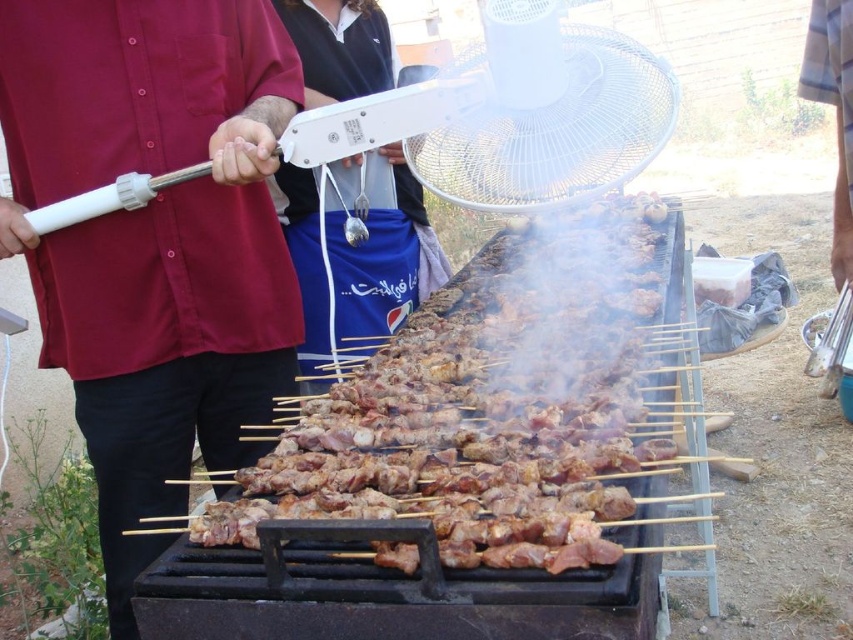
Question: Does maroon shirt at center appear on the right side of blue fabric shirt at center?

Choices:
 (A) yes
 (B) no

Answer: (B)

Question: Among these objects, which one is farthest from the camera?

Choices:
 (A) maroon shirt at center
 (B) blue fabric shirt at center
 (C) dark blue fabric pants at center

Answer: (C)

Question: Which of the following is the closest to the observer?

Choices:
 (A) (106, 493)
 (B) (819, 28)
 (C) (303, 465)

Answer: (C)

Question: Is maroon shirt at center to the left of blue fabric shirt at center from the viewer's perspective?

Choices:
 (A) no
 (B) yes

Answer: (B)

Question: Which point is farther to the camera?

Choices:
 (A) (306, 339)
 (B) (822, 76)

Answer: (A)

Question: Is dark blue fabric pants at center to the left of blue fabric shirt at center from the viewer's perspective?

Choices:
 (A) yes
 (B) no

Answer: (A)